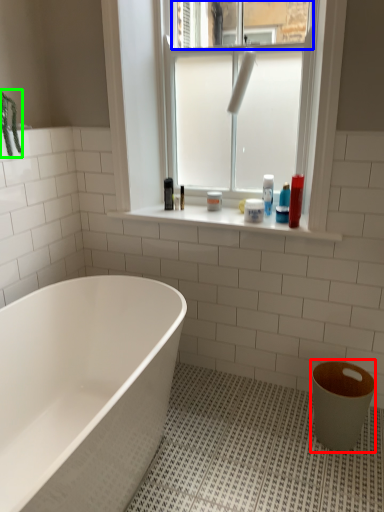
Question: Which is nearer to the toilet bowl (highlighted by a red box)? window screen (highlighted by a blue box) or plant (highlighted by a green box).

Choices:
 (A) window screen
 (B) plant

Answer: (A)